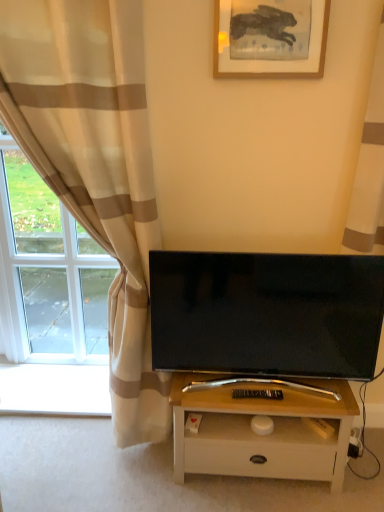
The height and width of the screenshot is (512, 384). What do you see at coordinates (369, 170) in the screenshot? I see `beige striped curtain at upper right, which is the 2th curtain from left to right` at bounding box center [369, 170].

This screenshot has height=512, width=384. What do you see at coordinates (266, 313) in the screenshot?
I see `black glossy tv at center` at bounding box center [266, 313].

Describe the element at coordinates (257, 394) in the screenshot. The width and height of the screenshot is (384, 512). I see `black plastic remote control at center` at that location.

At what (x,y) coordinates should I click in order to perform the action: click on beige striped curtain at left, acting as the 2th curtain starting from the right. Please return your answer as a coordinate pair (x, y). Image resolution: width=384 pixels, height=512 pixels. Looking at the image, I should click on (95, 166).

Image resolution: width=384 pixels, height=512 pixels. What are the coordinates of `beige striped curtain at upper right, arranged as the 1th curtain when viewed from the right` in the screenshot? It's located at coord(369,170).

Can you confirm if beige striped curtain at upper right, which is the 2th curtain from left to right, is bigger than black plastic remote control at center?

Indeed, beige striped curtain at upper right, which is the 2th curtain from left to right, has a larger size compared to black plastic remote control at center.

Is beige striped curtain at upper right, arranged as the 1th curtain when viewed from the right, to the right of black plastic remote control at center from the viewer's perspective?

→ Correct, you'll find beige striped curtain at upper right, arranged as the 1th curtain when viewed from the right, to the right of black plastic remote control at center.

Is there a large distance between beige striped curtain at upper right, arranged as the 1th curtain when viewed from the right, and black plastic remote control at center?

That's not correct — beige striped curtain at upper right, arranged as the 1th curtain when viewed from the right, is a little close to black plastic remote control at center.

Is beige striped curtain at upper right, arranged as the 1th curtain when viewed from the right, next to wooden picture frame at upper center?

beige striped curtain at upper right, arranged as the 1th curtain when viewed from the right, is not next to wooden picture frame at upper center, and they're not touching.

Considering the positions of objects beige striped curtain at upper right, arranged as the 1th curtain when viewed from the right, and wooden picture frame at upper center in the image provided, who is behind, beige striped curtain at upper right, arranged as the 1th curtain when viewed from the right, or wooden picture frame at upper center?

wooden picture frame at upper center is behind.

Which point is more distant from viewer, (x=357, y=198) or (x=247, y=76)?

Positioned behind is point (x=357, y=198).

Considering the sizes of objects beige striped curtain at upper right, arranged as the 1th curtain when viewed from the right, and wooden picture frame at upper center in the image provided, who is bigger, beige striped curtain at upper right, arranged as the 1th curtain when viewed from the right, or wooden picture frame at upper center?

beige striped curtain at upper right, arranged as the 1th curtain when viewed from the right, is bigger.

Measure the distance from black plastic remote control at center to beige striped curtain at upper right, arranged as the 1th curtain when viewed from the right.

A distance of 92.50 centimeters exists between black plastic remote control at center and beige striped curtain at upper right, arranged as the 1th curtain when viewed from the right.

Is black plastic remote control at center next to beige striped curtain at upper right, which is the 2th curtain from left to right, and touching it?

No, black plastic remote control at center is not in contact with beige striped curtain at upper right, which is the 2th curtain from left to right.

Which of these two, black plastic remote control at center or beige striped curtain at upper right, which is the 2th curtain from left to right, is thinner?

Thinner between the two is black plastic remote control at center.

Is beige striped curtain at upper right, which is the 2th curtain from left to right, completely or partially inside black plastic remote control at center?

Actually, beige striped curtain at upper right, which is the 2th curtain from left to right, is outside black plastic remote control at center.

From the image's perspective, relative to white wood table at center, is black glossy tv at center above or below?

black glossy tv at center is situated higher than white wood table at center in the image.

Which object is further away from the camera, black glossy tv at center or white wood table at center?

Positioned behind is white wood table at center.

Considering the sizes of black glossy tv at center and white wood table at center in the image, is black glossy tv at center bigger or smaller than white wood table at center?

Clearly, black glossy tv at center is smaller in size than white wood table at center.

From a real-world perspective, is black glossy tv at center located higher than white wood table at center?

Yes, from a real-world perspective, black glossy tv at center is on top of white wood table at center.

From their relative heights in the image, would you say beige striped curtain at left, acting as the 2th curtain starting from the right, is taller or shorter than beige striped curtain at upper right, arranged as the 1th curtain when viewed from the right?

Clearly, beige striped curtain at left, acting as the 2th curtain starting from the right, is taller compared to beige striped curtain at upper right, arranged as the 1th curtain when viewed from the right.

Is beige striped curtain at left, acting as the 2th curtain starting from the right, at the right side of beige striped curtain at upper right, which is the 2th curtain from left to right?

No.

From the image's perspective, relative to beige striped curtain at upper right, arranged as the 1th curtain when viewed from the right, is beige striped curtain at left, acting as the 2th curtain starting from the right, above or below?

Based on their image positions, beige striped curtain at left, acting as the 2th curtain starting from the right, is located beneath beige striped curtain at upper right, arranged as the 1th curtain when viewed from the right.

Can you tell me how much white wood table at center and black glossy tv at center differ in facing direction?

They differ by 0.00207 degrees in their facing directions.

Could you tell me if white wood table at center is facing black glossy tv at center?

No, white wood table at center does not turn towards black glossy tv at center.

Is point (310, 404) farther from camera compared to point (234, 263)?

That is True.

From the image's perspective, is white wood table at center below black glossy tv at center?

Indeed, from the image's perspective, white wood table at center is shown beneath black glossy tv at center.

Is point (233, 395) closer or farther from the camera than point (278, 64)?

Point (233, 395) appears to be farther away from the viewer than point (278, 64).

Is wooden picture frame at upper center surrounded by black plastic remote control at center?

No.

Does black plastic remote control at center lie in front of wooden picture frame at upper center?

That is False.

In the image, there is a beige striped curtain at upper right, arranged as the 1th curtain when viewed from the right. Identify the location of remote control below it (from the image's perspective). Image resolution: width=384 pixels, height=512 pixels. (257, 394).

Where is `picture frame lying on the left of beige striped curtain at upper right, which is the 2th curtain from left to right`? This screenshot has height=512, width=384. picture frame lying on the left of beige striped curtain at upper right, which is the 2th curtain from left to right is located at coordinates (267, 58).

Looking at the image, which one is located closer to wooden picture frame at upper center, beige striped curtain at left, which is counted as the first curtain, starting from the left, or black plastic remote control at center?

beige striped curtain at left, which is counted as the first curtain, starting from the left, lies closer to wooden picture frame at upper center than the other object.

From the image, which object appears to be farther from beige striped curtain at upper right, arranged as the 1th curtain when viewed from the right, black glossy tv at center or white wood table at center?

Among the two, white wood table at center is located further to beige striped curtain at upper right, arranged as the 1th curtain when viewed from the right.

Consider the image. Which object lies further to the anchor point white wood table at center, wooden picture frame at upper center or beige striped curtain at upper right, arranged as the 1th curtain when viewed from the right?

wooden picture frame at upper center lies further to white wood table at center than the other object.

Based on their spatial positions, is beige striped curtain at left, acting as the 2th curtain starting from the right, or wooden picture frame at upper center further from black glossy tv at center?

wooden picture frame at upper center is positioned further to the anchor black glossy tv at center.

Estimate the real-world distances between objects in this image. Which object is closer to black glossy tv at center, beige striped curtain at upper right, arranged as the 1th curtain when viewed from the right, or white wood table at center?

Based on the image, white wood table at center appears to be nearer to black glossy tv at center.

Estimate the real-world distances between objects in this image. Which object is further from black plastic remote control at center, black glossy tv at center or wooden picture frame at upper center?

wooden picture frame at upper center.

Which object lies nearer to the anchor point beige striped curtain at upper right, arranged as the 1th curtain when viewed from the right, white wood table at center or wooden picture frame at upper center?

wooden picture frame at upper center is positioned closer to the anchor beige striped curtain at upper right, arranged as the 1th curtain when viewed from the right.

Looking at the image, which one is located closer to white wood table at center, beige striped curtain at upper right, arranged as the 1th curtain when viewed from the right, or beige striped curtain at left, acting as the 2th curtain starting from the right?

beige striped curtain at left, acting as the 2th curtain starting from the right, is positioned closer to the anchor white wood table at center.

Where is `remote control between beige striped curtain at left, acting as the 2th curtain starting from the right, and white wood table at center from left to right`? Image resolution: width=384 pixels, height=512 pixels. remote control between beige striped curtain at left, acting as the 2th curtain starting from the right, and white wood table at center from left to right is located at coordinates (257, 394).

The width and height of the screenshot is (384, 512). I want to click on picture frame situated between beige striped curtain at left, which is counted as the first curtain, starting from the left, and beige striped curtain at upper right, which is the 2th curtain from left to right, from left to right, so click(267, 58).

What are the coordinates of `television between wooden picture frame at upper center and black plastic remote control at center vertically` in the screenshot? It's located at (266, 313).

Identify the location of television that lies between beige striped curtain at upper right, which is the 2th curtain from left to right, and black plastic remote control at center from top to bottom. point(266,313).